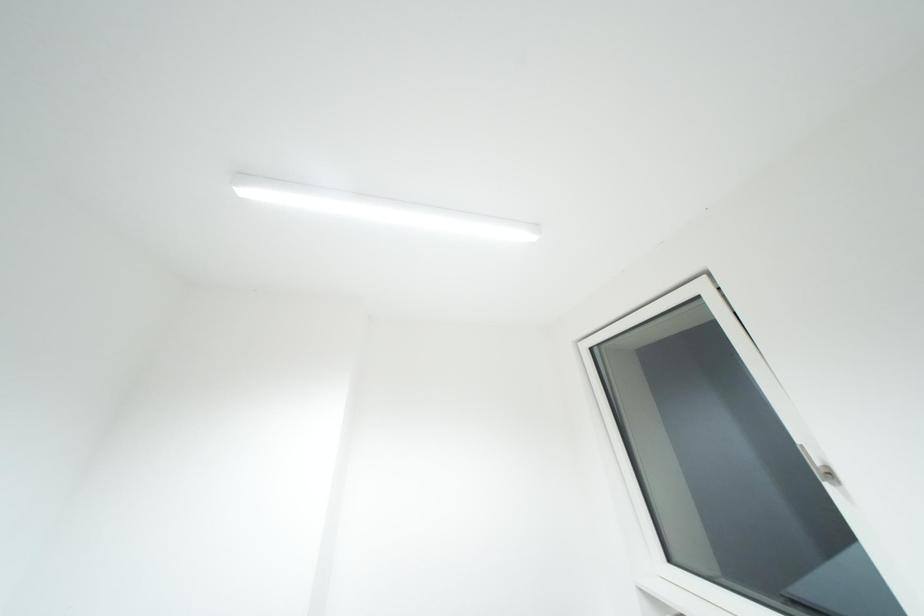
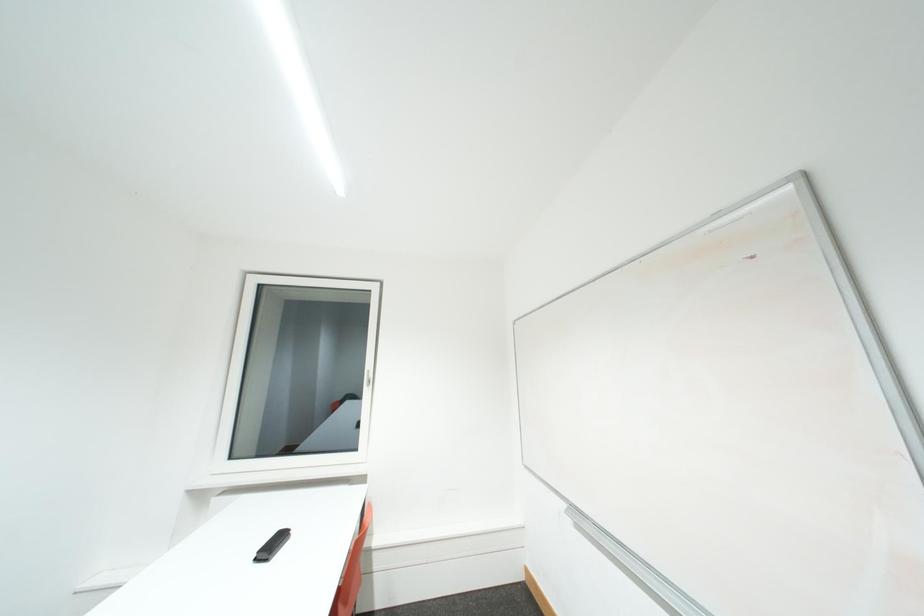
Question: The camera is either moving clockwise (left) or counter-clockwise (right) around the object. The first image is from the beginning of the video and the second image is from the end. Is the camera moving left or right when shooting the video?

Choices:
 (A) Left
 (B) Right

Answer: (A)